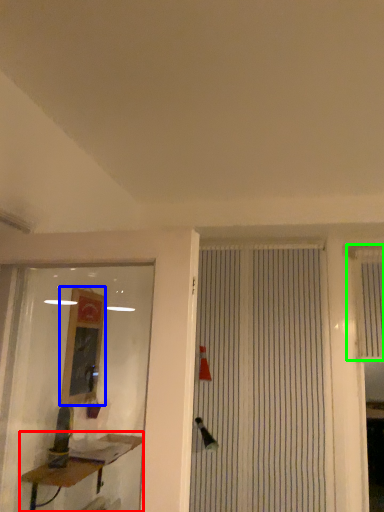
Question: Based on their relative distances, which object is farther from table (highlighted by a red box)? Choose from job (highlighted by a blue box) and shutter (highlighted by a green box).

Choices:
 (A) job
 (B) shutter

Answer: (B)